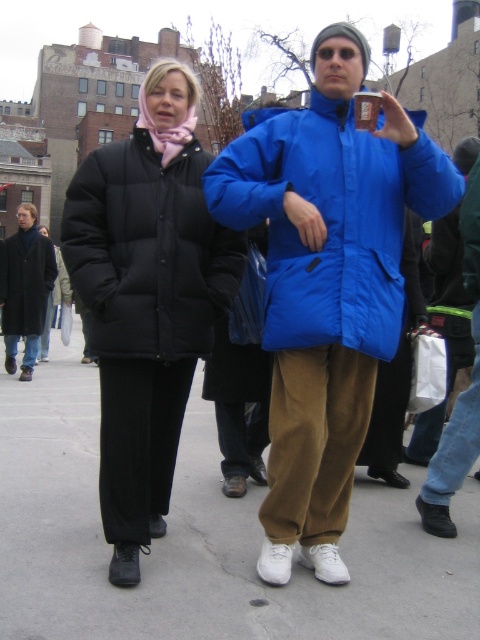
Question: Is black puffy jacket at left bigger than black matte jacket at left?

Choices:
 (A) yes
 (B) no

Answer: (A)

Question: Is white concrete pavement at center further to camera compared to blue synthetic jacket at center?

Choices:
 (A) no
 (B) yes

Answer: (A)

Question: Which point is closer to the camera taking this photo?

Choices:
 (A) (332, 320)
 (B) (476, 508)
 (C) (12, 324)
 (D) (361, 92)

Answer: (A)

Question: Estimate the real-world distances between objects in this image. Which object is farther from the white concrete pavement at center?

Choices:
 (A) black puffy jacket at left
 (B) black matte jacket at left

Answer: (B)

Question: Which point is farther to the camera?

Choices:
 (A) (369, 122)
 (B) (474, 234)
 (C) (146, 314)

Answer: (B)

Question: Does blue puffy jacket at center appear on the right side of black puffy jacket at left?

Choices:
 (A) no
 (B) yes

Answer: (B)